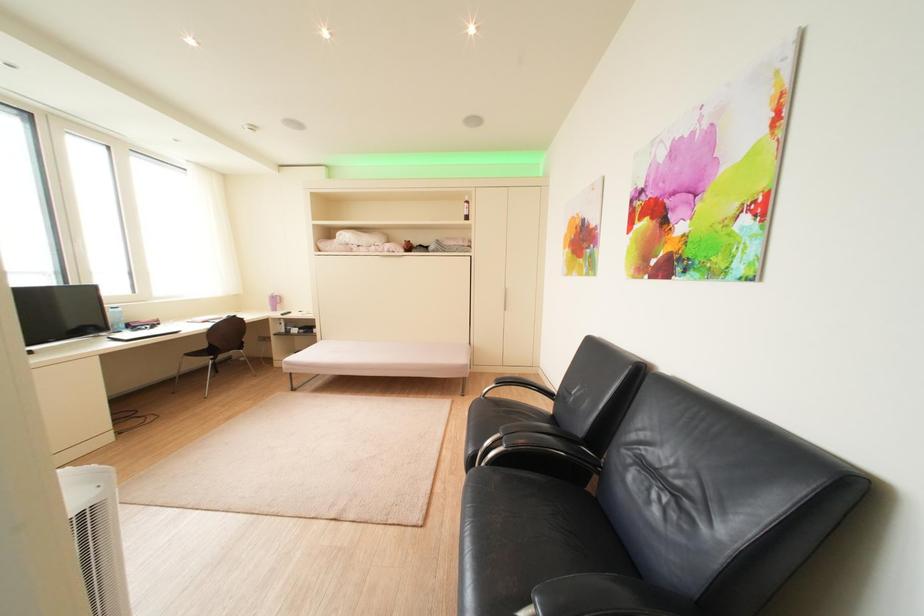
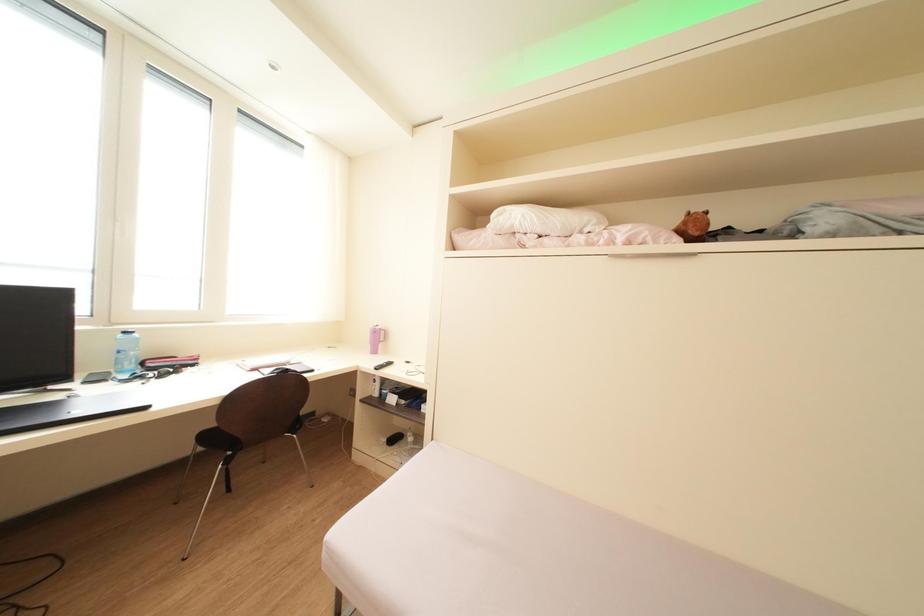
The images are taken continuously from a first-person perspective. In which direction are you moving?

The cameraman moved toward left, forward.